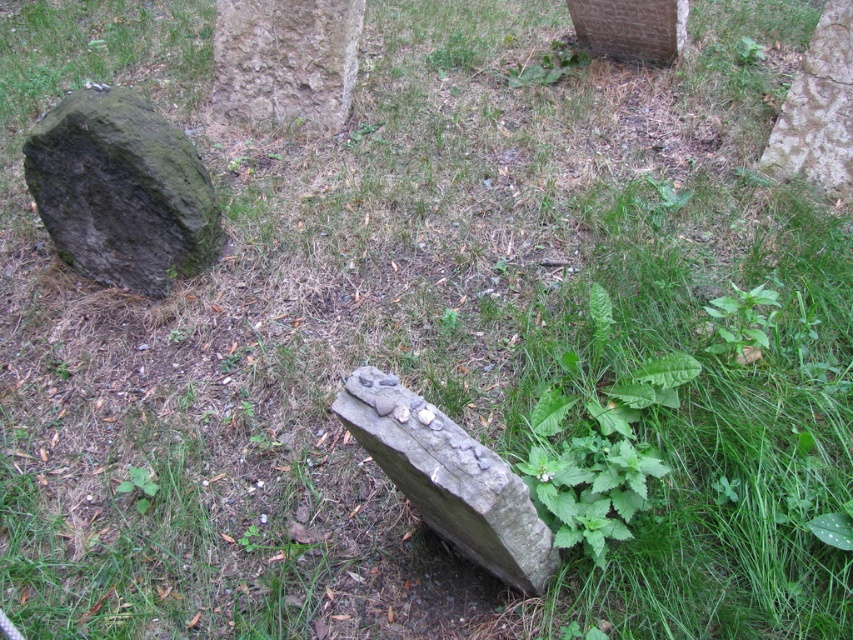
Question: Can you confirm if rough textured stone at upper center is positioned above smooth gray stone at upper center?

Choices:
 (A) no
 (B) yes

Answer: (A)

Question: Which point is farther from the camera taking this photo?

Choices:
 (A) (309, 29)
 (B) (631, 8)

Answer: (B)

Question: Is rough textured stone at upper center closer to camera compared to smooth gray stone at upper center?

Choices:
 (A) no
 (B) yes

Answer: (B)

Question: Which object is the closest to the smooth gray stone at upper center?

Choices:
 (A) gray rough stone at center
 (B) green mossy stone at left
 (C) rough textured stone at upper center

Answer: (C)

Question: Considering the real-world distances, which object is farthest from the gray rough stone at center?

Choices:
 (A) rough textured stone at upper center
 (B) green mossy stone at left
 (C) smooth gray stone at upper center

Answer: (C)

Question: In this image, where is gray rough stone at center located relative to rough textured stone at upper center?

Choices:
 (A) left
 (B) right

Answer: (B)